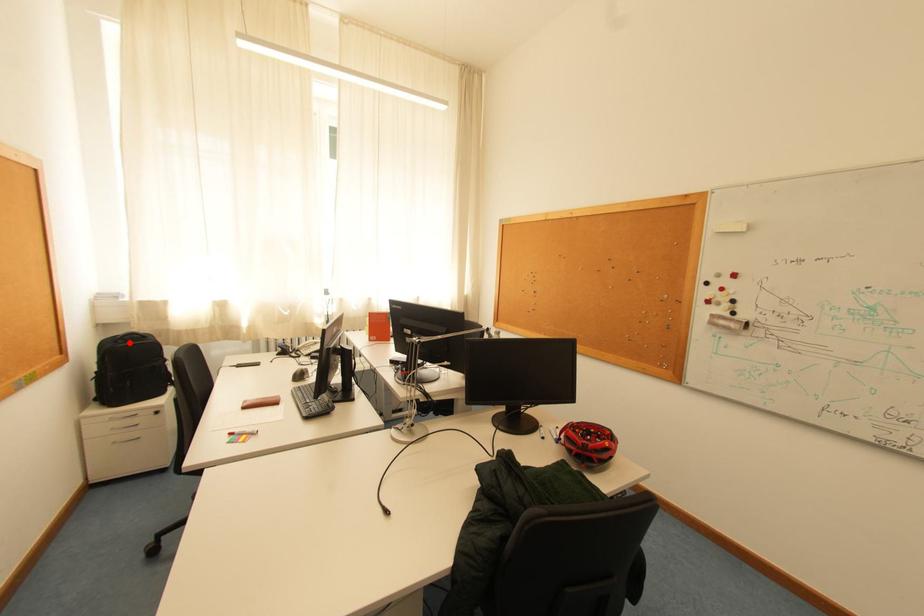
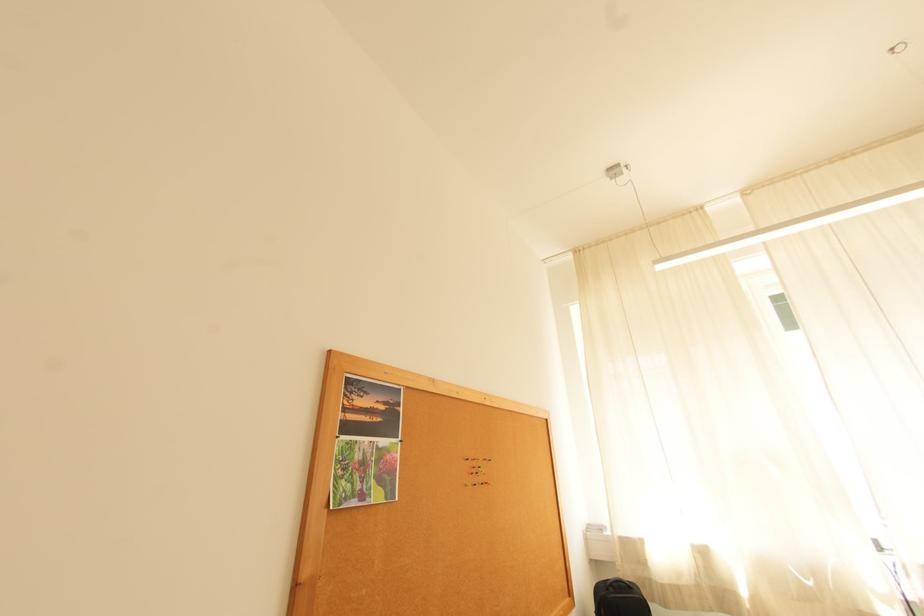
The point at the highlighted location is marked in the first image. Where is the corresponding point in the second image?

(619, 591)